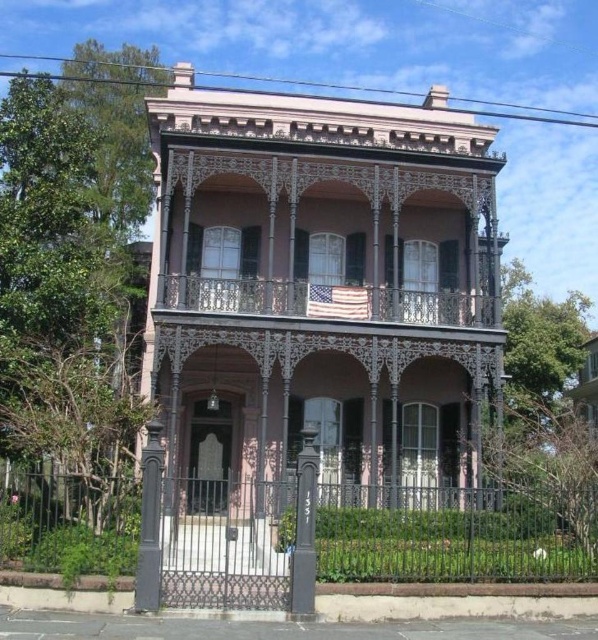
You are a visitor arriving at the historic house and see the black wrought iron gate at center and the black polished metal post at center. Which object is positioned lower in the scene?

The black wrought iron gate at center is located below the black polished metal post at center, so the black wrought iron gate at center is positioned lower in the scene.

You are standing at the front entrance of the house and want to locate the black wrought iron post at lower left. According to the coordinates provided, where would you find it?

The black wrought iron post at lower left is located at coordinates 0.819 on the x axis and 0.251 on the y axis.

You are standing in front of the historic house and notice two points marked on the facade. The first point is at coordinate point [38,566] and the second is at point [145,564]. Which point is closer to you?

Point [38,566] is closer to you because it is further to the camera than point [145,564].